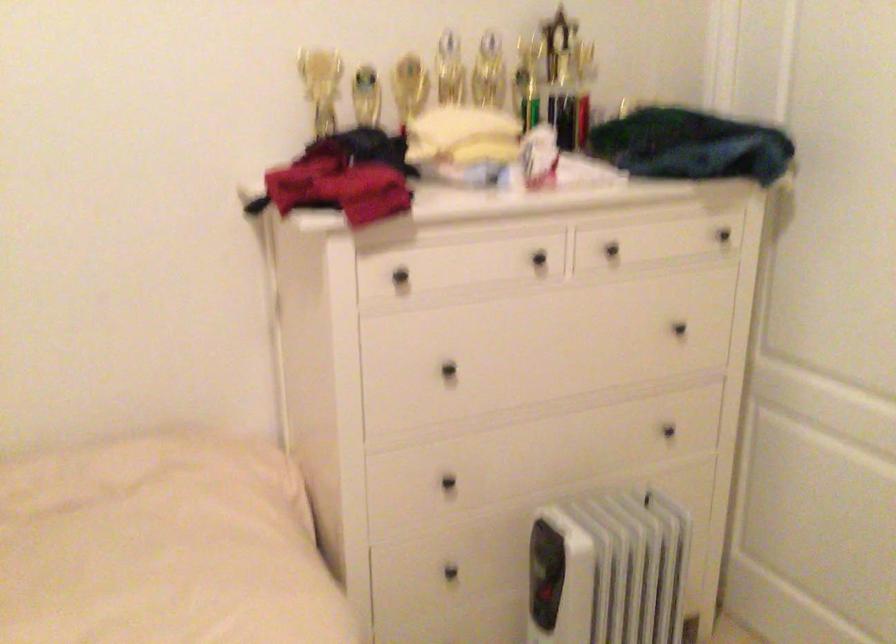
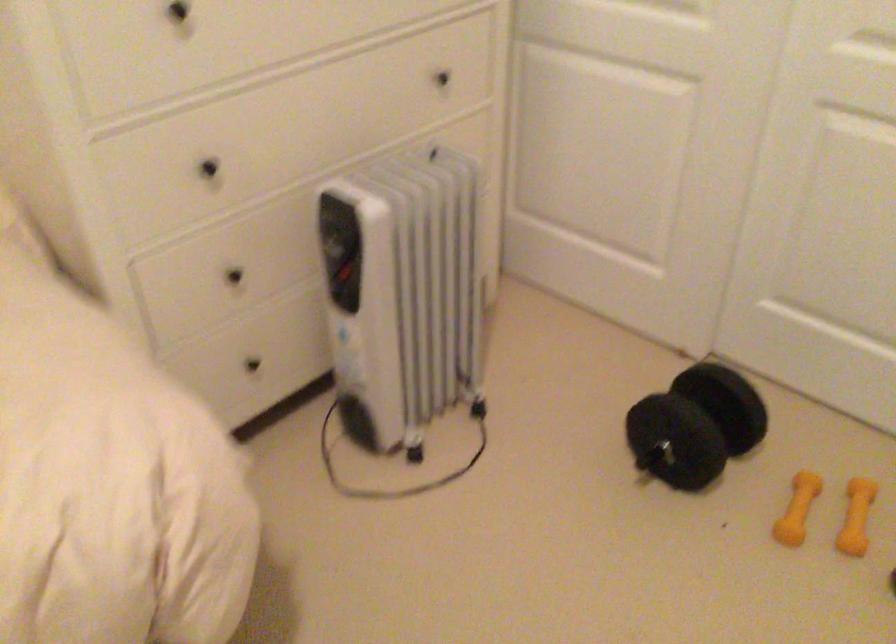
Where in the second image is the point corresponding to point 445,484 from the first image?

(209, 167)